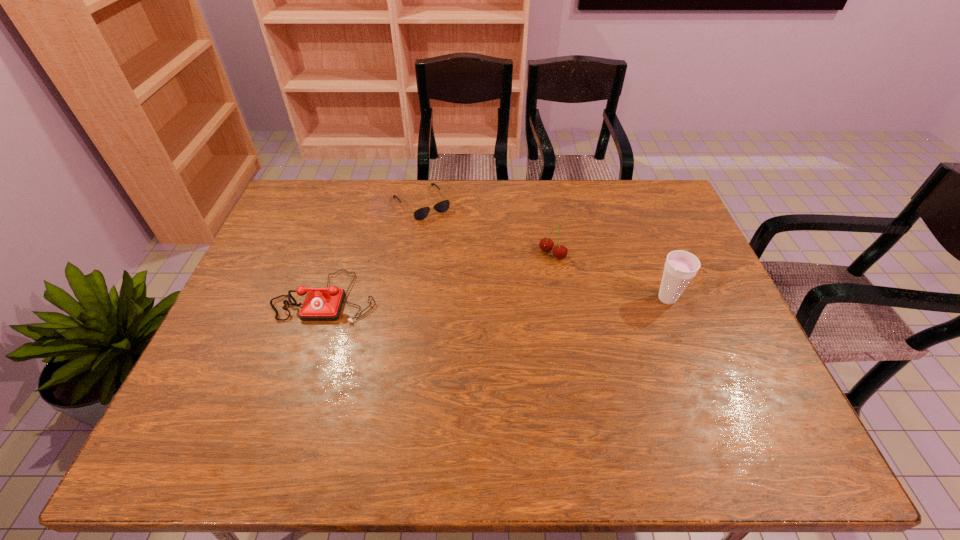
Locate an element on the screen. The image size is (960, 540). vacant space at the left edge of the desktop is located at coordinates (297, 260).

Find the location of a particular element. Image resolution: width=960 pixels, height=540 pixels. free space at the right edge of the desktop is located at coordinates (727, 342).

Find the location of `vacant region at the far left corner`. vacant region at the far left corner is located at coordinates (321, 218).

This screenshot has width=960, height=540. Find the location of `free region at the near left corner`. free region at the near left corner is located at coordinates (222, 401).

In the image, there is a desktop. At what (x,y) coordinates should I click in order to perform the action: click on vacant space at the far right corner. Please return your answer as a coordinate pair (x, y). This screenshot has height=540, width=960. Looking at the image, I should click on (629, 198).

The height and width of the screenshot is (540, 960). In order to click on free space at the near right corner in this screenshot , I will do `click(712, 404)`.

Where is `vacant space that's between the farthest object and the second farthest object`? vacant space that's between the farthest object and the second farthest object is located at coordinates (488, 228).

Identify the location of empty location between the cherry and the farthest object. (488, 228).

Image resolution: width=960 pixels, height=540 pixels. Identify the location of free space between the third tallest object and the shortest object. (374, 250).

Identify the location of vacant space in between the rightmost object and the second shortest object. (496, 298).